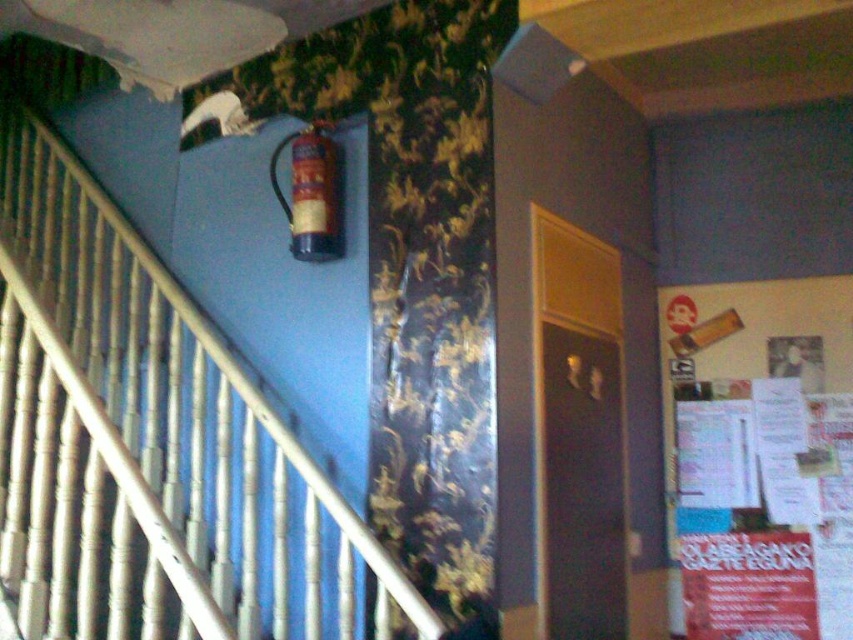
Does white paper poster at right have a greater height compared to metallic gold extinguisher at upper center?

Indeed, white paper poster at right has a greater height compared to metallic gold extinguisher at upper center.

Can you confirm if white paper poster at right is positioned below metallic gold extinguisher at upper center?

Correct, white paper poster at right is located below metallic gold extinguisher at upper center.

What do you see at coordinates (763, 509) in the screenshot? I see `white paper poster at right` at bounding box center [763, 509].

Locate an element on the screen. This screenshot has width=853, height=640. white paper poster at right is located at coordinates (763, 509).

Does white matte railing at upper left lie behind metallic gold extinguisher at upper center?

That is False.

Can you confirm if white matte railing at upper left is positioned to the left of metallic gold extinguisher at upper center?

Correct, you'll find white matte railing at upper left to the left of metallic gold extinguisher at upper center.

Between point (318, 589) and point (299, 220), which one is positioned in front?

Point (318, 589)

I want to click on white matte railing at upper left, so click(x=151, y=449).

Which is more to the left, white matte railing at upper left or white paper poster at right?

Positioned to the left is white matte railing at upper left.

Can you confirm if white matte railing at upper left is positioned above white paper poster at right?

Indeed, white matte railing at upper left is positioned over white paper poster at right.

Which is behind, point (113, 625) or point (827, 627)?

The point (827, 627) is more distant.

Locate an element on the screen. This screenshot has width=853, height=640. white matte railing at upper left is located at coordinates (151, 449).